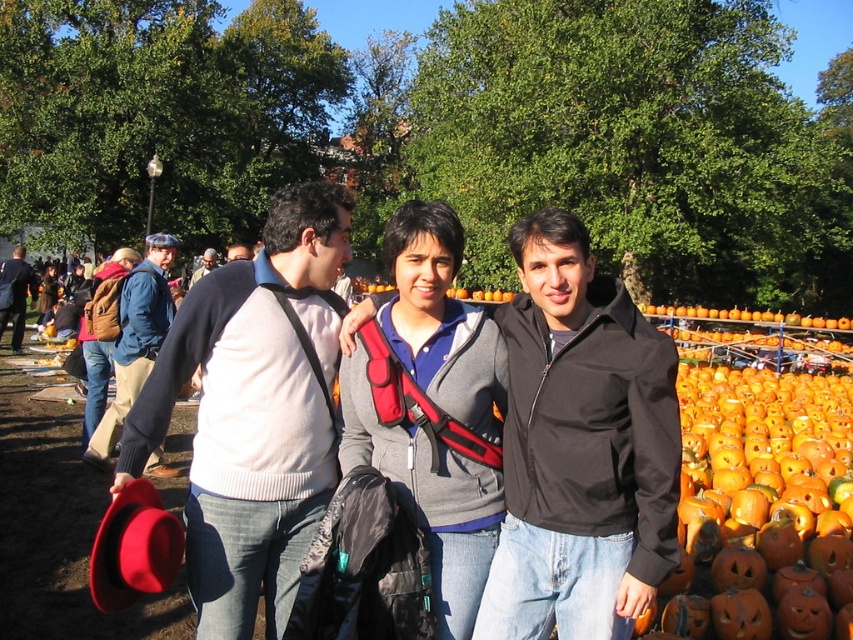
Who is taller, gray matte jacket at center or matte black sweater at center?

Standing taller between the two is matte black sweater at center.

Who is shorter, gray matte jacket at center or matte black sweater at center?

gray matte jacket at center

Is point (457, 387) positioned behind point (13, 284)?

That is False.

Image resolution: width=853 pixels, height=640 pixels. Find the location of `gray matte jacket at center`. gray matte jacket at center is located at coordinates (432, 404).

Is gray matte jacket at center shorter than matte gray sweater at center?

Yes.

The width and height of the screenshot is (853, 640). What do you see at coordinates (432, 404) in the screenshot? I see `gray matte jacket at center` at bounding box center [432, 404].

Find the location of a particular element. The image size is (853, 640). gray matte jacket at center is located at coordinates (432, 404).

Does matte brown backpack at center appear on the right side of matte gray sweater at center?

Incorrect, matte brown backpack at center is not on the right side of matte gray sweater at center.

Which of these two, matte brown backpack at center or matte gray sweater at center, stands shorter?

Standing shorter between the two is matte gray sweater at center.

Is point (84, 353) positioned after point (227, 260)?

No.

At what (x,y) coordinates should I click in order to perform the action: click on matte brown backpack at center. Please return your answer as a coordinate pair (x, y). Looking at the image, I should click on (93, 378).